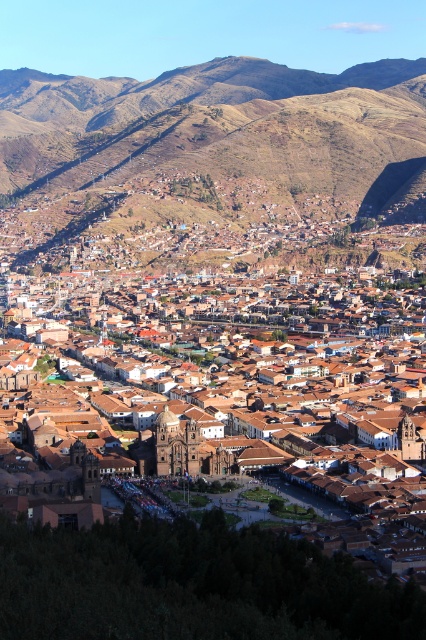
Between brown rocky mountain at upper center and brown clay buildings at center, which one is positioned lower?

brown clay buildings at center

Is brown rocky mountain at upper center positioned in front of brown clay buildings at center?

No, brown rocky mountain at upper center is further to the viewer.

Does point (163, 161) come behind point (374, 493)?

Yes, point (163, 161) is farther from viewer.

Find the location of a particular element. The height and width of the screenshot is (640, 426). brown rocky mountain at upper center is located at coordinates (215, 164).